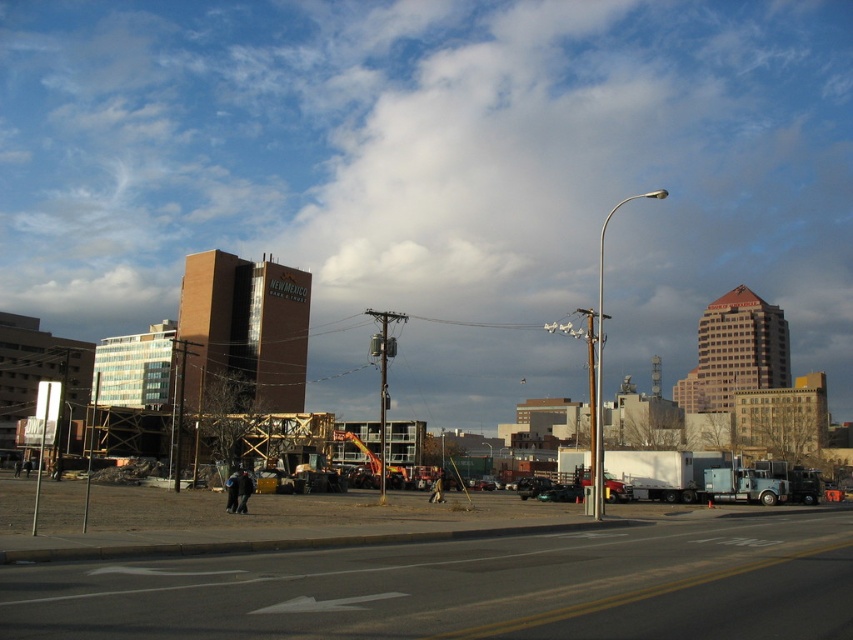
You are a delivery driver who needs to load a tall package onto your vehicle. You see a green matte car at center and a metallic silver truck at center. Which vehicle should you choose to ensure the package fits without exceeding height restrictions?

The metallic silver truck at center is taller than the green matte car at center, so you should choose the metallic silver truck at center to ensure the tall package fits without exceeding height restrictions.

You are a delivery driver who needs to park your metallic silver truck at center near the brown wooden construction site at center. Is there enough space to park your truck next to the construction site without overlapping?

The brown wooden construction site at center is bigger than the metallic silver truck at center. Since the construction site is larger, there might be sufficient space to park the metallic silver truck at center next to it without overlapping, but this depends on the exact dimensions and layout of the area.